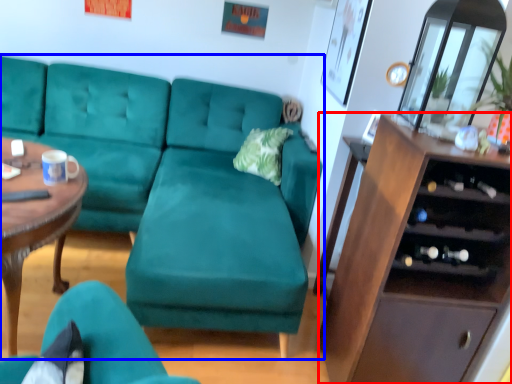
Question: Which point is closer to the camera, cabinetry (highlighted by a red box) or studio couch (highlighted by a blue box)?

Choices:
 (A) cabinetry
 (B) studio couch

Answer: (A)